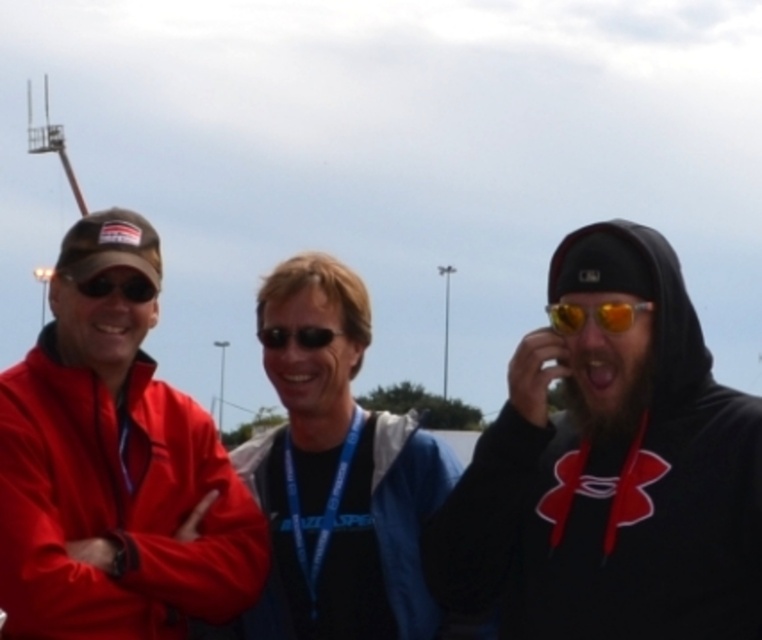
Question: Which point is farther to the camera?

Choices:
 (A) matte black sunglasses at center
 (B) red matte jacket at left
 (C) blue fabric jacket at center
 (D) black hoodie at right

Answer: (A)

Question: Among these objects, which one is farthest from the camera?

Choices:
 (A) red matte jacket at left
 (B) matte black sunglasses at center
 (C) matte red jacket at left

Answer: (B)

Question: Is black hoodie at right thinner than matte black sunglasses at center?

Choices:
 (A) yes
 (B) no

Answer: (B)

Question: Does blue fabric jacket at center have a greater width compared to yellow reflective lens at center?

Choices:
 (A) yes
 (B) no

Answer: (A)

Question: Does black hoodie at right have a smaller size compared to matte black sunglasses at center?

Choices:
 (A) yes
 (B) no

Answer: (B)

Question: Which point is closer to the camera?

Choices:
 (A) pos(66,337)
 (B) pos(312,376)
 (C) pos(631,448)

Answer: (C)